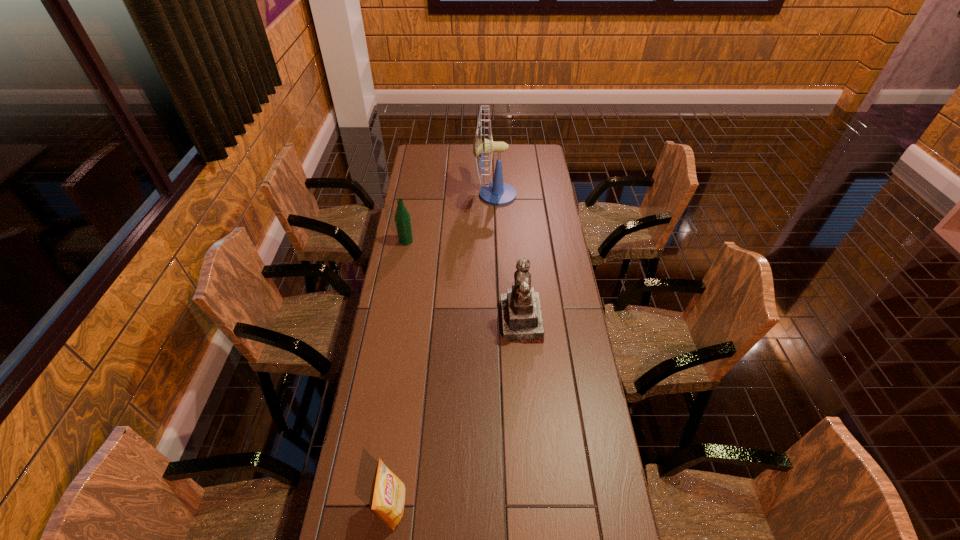
Where is `the farthest object`? Image resolution: width=960 pixels, height=540 pixels. the farthest object is located at coordinates (497, 193).

Where is `the tallest object`? The height and width of the screenshot is (540, 960). the tallest object is located at coordinates (497, 193).

Identify the location of figurine. The height and width of the screenshot is (540, 960). (522, 321).

Locate an element on the screen. The height and width of the screenshot is (540, 960). the third farthest object is located at coordinates (522, 321).

Find the location of `the second shortest object`. the second shortest object is located at coordinates (402, 217).

At what (x,y) coordinates should I click in order to perform the action: click on the leftmost object. Please return your answer as a coordinate pair (x, y). The width and height of the screenshot is (960, 540). Looking at the image, I should click on (402, 217).

At what (x,y) coordinates should I click in order to perform the action: click on the second object from left to right. Please return your answer as a coordinate pair (x, y). Looking at the image, I should click on (387, 498).

Find the location of `the nearest object`. the nearest object is located at coordinates (387, 498).

Where is `vacant area situated at the front of the tallest object where the blades are visible`? The image size is (960, 540). vacant area situated at the front of the tallest object where the blades are visible is located at coordinates (417, 195).

The width and height of the screenshot is (960, 540). In order to click on vacant region located 0.270m at the front of the tallest object where the blades are visible in this screenshot , I will do (419, 195).